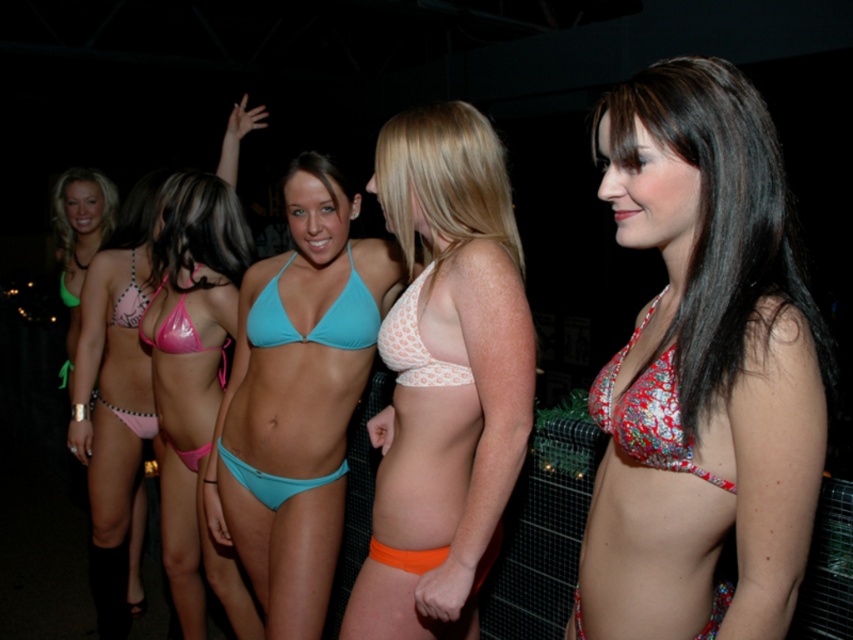
Question: Can you confirm if matte pink bikini bottom at center is positioned to the left of matte blue bikini top at center?

Choices:
 (A) no
 (B) yes

Answer: (B)

Question: Is printed fabric bikini top at center positioned in front of white mesh bikini top at center?

Choices:
 (A) no
 (B) yes

Answer: (B)

Question: Can you confirm if teal fabric bikini top at center is smaller than matte blue bikini at center?

Choices:
 (A) yes
 (B) no

Answer: (B)

Question: Which point is farther to the camera?

Choices:
 (A) teal fabric bikini bottom at center
 (B) matte blue bikini at center
 (C) white dotted fabric bikini bottom at center
 (D) printed fabric bikini top at right

Answer: (A)

Question: Based on their relative distances, which object is nearer to the teal fabric bikini bottom at center?

Choices:
 (A) white mesh bikini top at center
 (B) matte pink bikini bottom at center
 (C) matte blue bikini at center

Answer: (C)

Question: Which point is farther from the camera taking this photo?

Choices:
 (A) (669, 369)
 (B) (328, 337)
 (C) (396, 440)

Answer: (B)